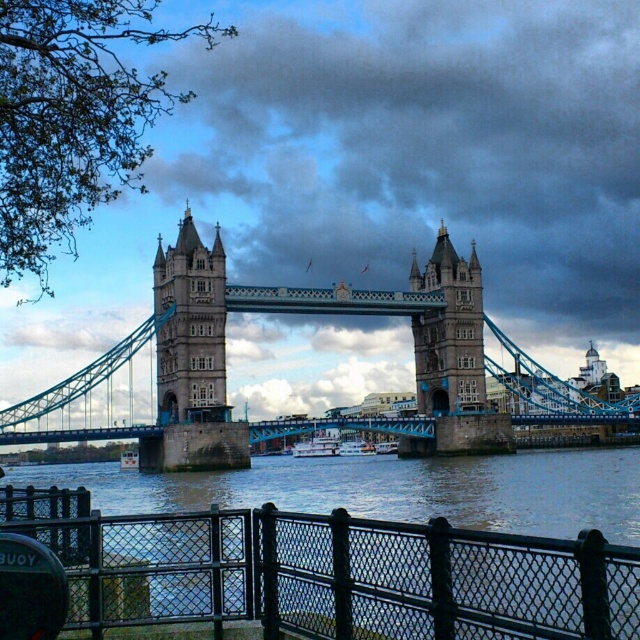
Question: Can you confirm if stone tower at center is wider than stone stonework tower at center?

Choices:
 (A) no
 (B) yes

Answer: (B)

Question: Can you confirm if black metal fence at lower center is wider than stone tower at center?

Choices:
 (A) yes
 (B) no

Answer: (A)

Question: Which object appears farthest from the camera in this image?

Choices:
 (A) teal stone suspension bridge at center
 (B) black metal fence at lower center

Answer: (A)

Question: Can you confirm if black metal fence at lower center is positioned to the right of stone stonework tower at center?

Choices:
 (A) yes
 (B) no

Answer: (B)

Question: Which object is farther from the camera taking this photo?

Choices:
 (A) black metal fence at lower center
 (B) teal stone suspension bridge at center
 (C) stone tower at center

Answer: (C)

Question: Which point appears farthest from the camera in this image?

Choices:
 (A) (470, 316)
 (B) (628, 616)
 (C) (202, 396)

Answer: (A)